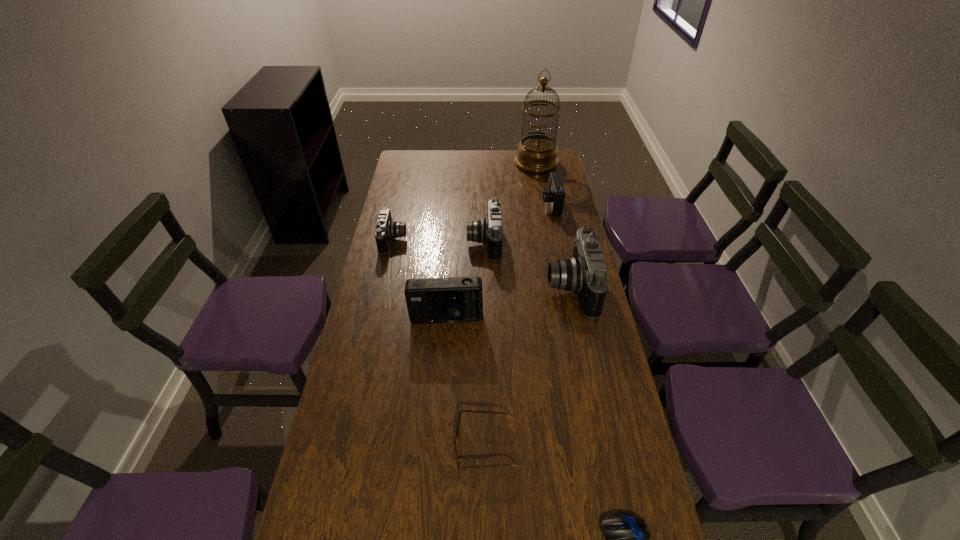
Where is `vacant area situated on the front-facing side of the second black camera from right to left`? This screenshot has width=960, height=540. vacant area situated on the front-facing side of the second black camera from right to left is located at coordinates (452, 242).

Image resolution: width=960 pixels, height=540 pixels. Identify the location of free space located 0.100m on the front-facing side of the right blue camera. (518, 206).

Image resolution: width=960 pixels, height=540 pixels. In order to click on vacant space located 0.070m on the front-facing side of the right blue camera in this screenshot , I will do `click(525, 206)`.

I want to click on vacant space located 0.380m on the front-facing side of the right blue camera, so click(x=453, y=206).

The height and width of the screenshot is (540, 960). In order to click on vacant space situated 0.230m on the front-facing side of the smallest black camera in this screenshot , I will do `click(465, 240)`.

Where is `vacant area situated on the lenses of the seventh farthest object`? The height and width of the screenshot is (540, 960). vacant area situated on the lenses of the seventh farthest object is located at coordinates pyautogui.click(x=358, y=446).

Identify the location of vacant space located on the lenses of the seventh farthest object. The width and height of the screenshot is (960, 540). (424, 446).

At what (x,y) coordinates should I click in order to perform the action: click on free spot located 0.130m on the lenses of the seventh farthest object. Please return your answer as a coordinate pair (x, y). Looking at the image, I should click on (405, 446).

Image resolution: width=960 pixels, height=540 pixels. Find the location of `object that is at the far edge`. object that is at the far edge is located at coordinates (537, 153).

Identify the location of object that is at the left edge. (386, 229).